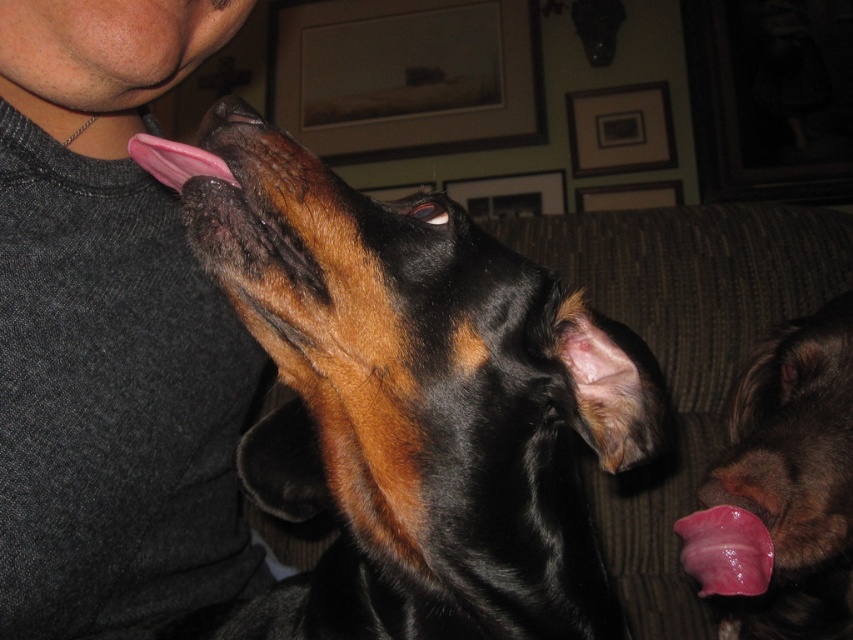
Question: Does gray fabric shirt at left appear over pink flesh tongue at lower right?

Choices:
 (A) no
 (B) yes

Answer: (B)

Question: Where is black shiny fur at upper center located in relation to pink glossy tongue at upper left in the image?

Choices:
 (A) above
 (B) below

Answer: (B)

Question: Which of the following is the closest to the observer?

Choices:
 (A) pink glossy tongue at lower right
 (B) pink glossy tongue at upper left
 (C) gray fabric shirt at left
 (D) pink flesh tongue at lower right

Answer: (B)

Question: Which of these objects is positioned closest to the black shiny fur at upper center?

Choices:
 (A) pink flesh tongue at lower right
 (B) pink glossy tongue at upper left
 (C) gray fabric shirt at left

Answer: (B)

Question: Which point is farther from the camera taking this photo?

Choices:
 (A) (316, 637)
 (B) (173, 19)

Answer: (B)

Question: Is gray fabric shirt at left wider than pink flesh tongue at lower right?

Choices:
 (A) yes
 (B) no

Answer: (A)